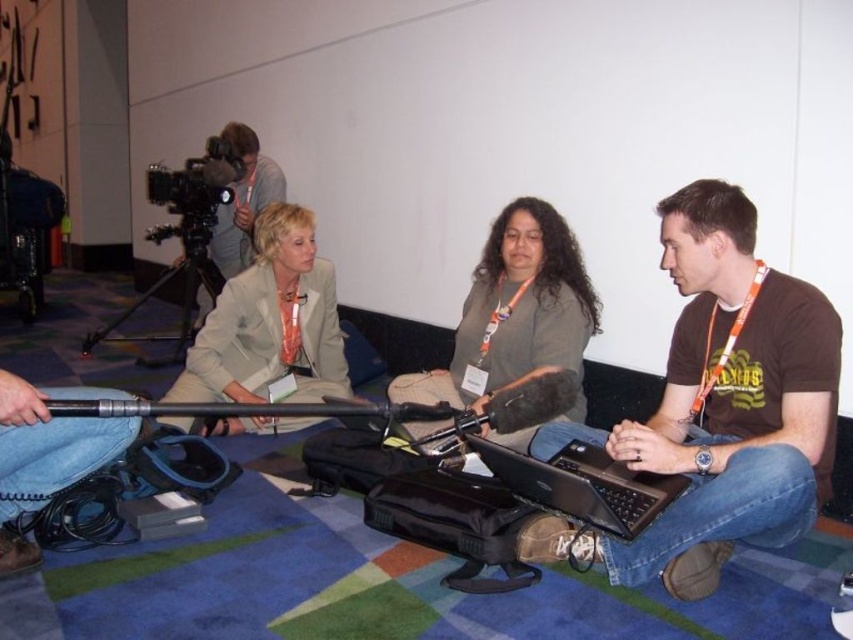
Does point (535, 365) lie in front of point (310, 266)?

Yes, it is.

Which is more to the right, dark green fabric shirt at center or beige fabric jacket at center?

Answer: dark green fabric shirt at center

This screenshot has width=853, height=640. Identify the location of dark green fabric shirt at center. (515, 314).

Is dark green fabric shirt at center closer to camera compared to black plastic video camera at upper left?

Yes, dark green fabric shirt at center is in front of black plastic video camera at upper left.

What do you see at coordinates (515, 314) in the screenshot? I see `dark green fabric shirt at center` at bounding box center [515, 314].

At what (x,y) coordinates should I click in order to perform the action: click on dark green fabric shirt at center. Please return your answer as a coordinate pair (x, y). Looking at the image, I should click on (515, 314).

Is beige fabric jacket at center thinner than black metal tripod at lower left?

Indeed, beige fabric jacket at center has a lesser width compared to black metal tripod at lower left.

Is beige fabric jacket at center bigger than black metal tripod at lower left?

Incorrect, beige fabric jacket at center is not larger than black metal tripod at lower left.

This screenshot has width=853, height=640. In order to click on beige fabric jacket at center in this screenshot , I will do `click(270, 323)`.

The height and width of the screenshot is (640, 853). I want to click on beige fabric jacket at center, so click(270, 323).